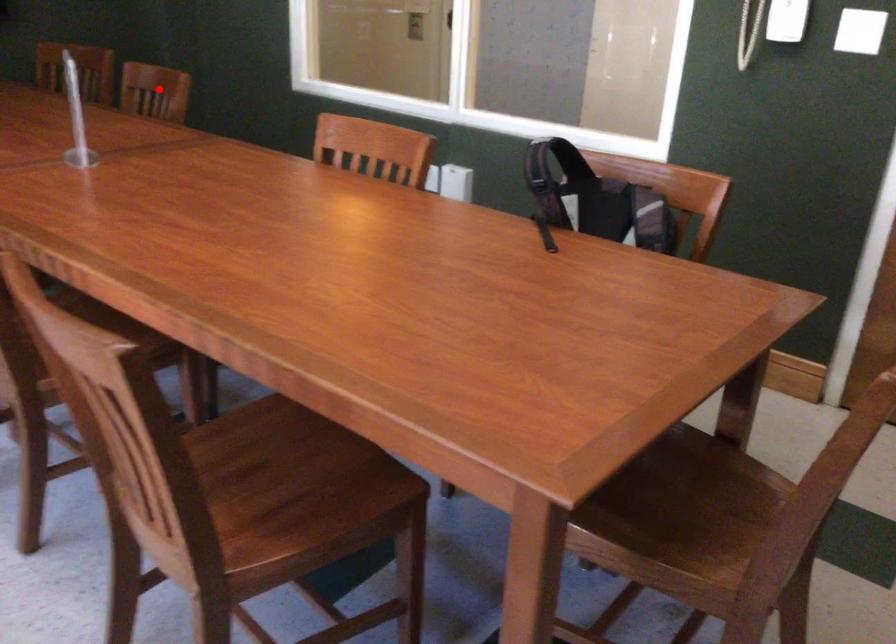
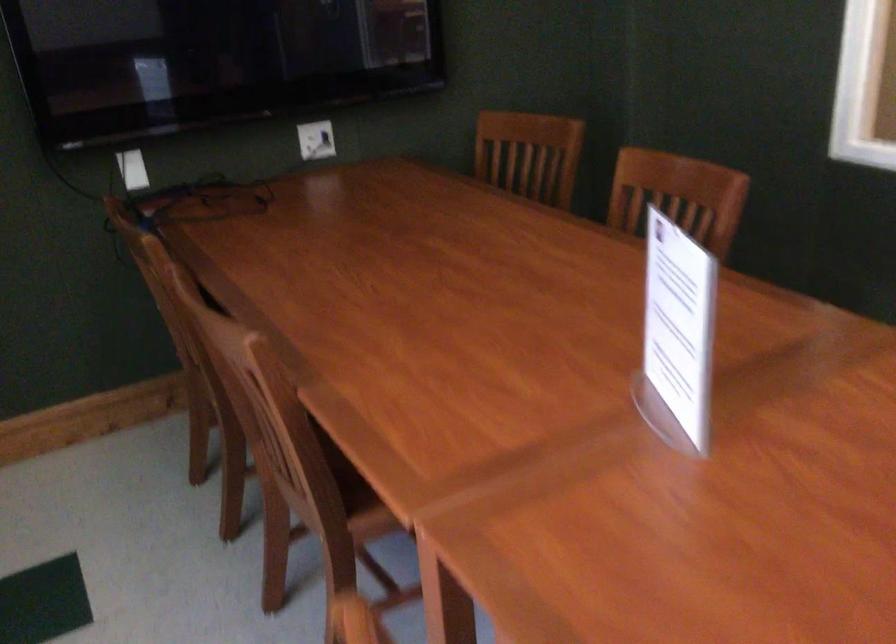
Question: I am providing you with two images of the same scene from different viewpoints. Given a red point in image1, look at the same physical point in image2. Is it:

Choices:
 (A) Closer to the viewpoint
 (B) Farther from the viewpoint

Answer: (A)